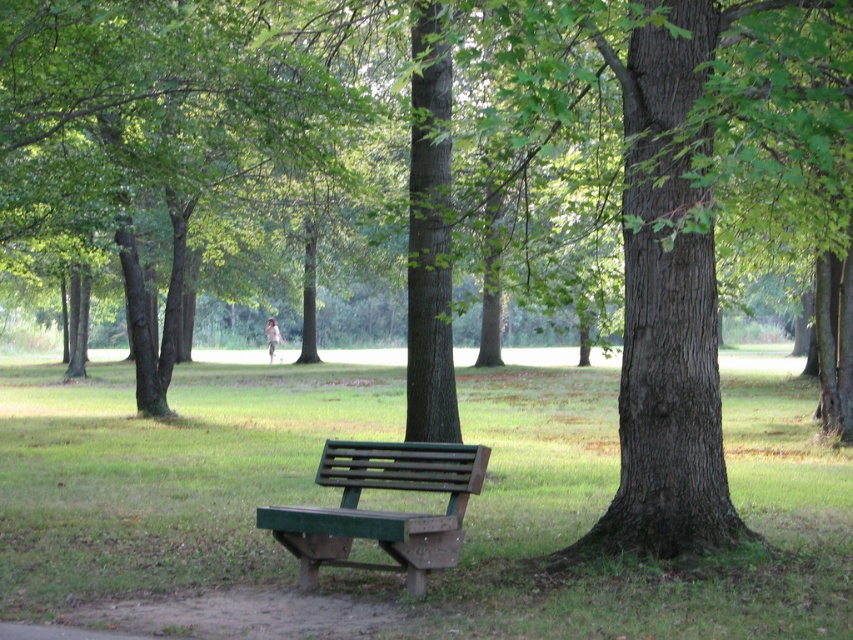
Consider the image. Is green leafy tree at center wider than green wood bench at lower center?

Yes, green leafy tree at center is wider than green wood bench at lower center.

Which is in front, point (264, 138) or point (415, 548)?

Positioned in front is point (415, 548).

Where is `green leafy tree at center`? green leafy tree at center is located at coordinates (146, 129).

Identify the location of green leafy tree at center. The width and height of the screenshot is (853, 640). (146, 129).

Is point (1, 456) positioned before point (173, 77)?

No, it is not.

The image size is (853, 640). Find the location of `green grass at center`. green grass at center is located at coordinates (608, 499).

The width and height of the screenshot is (853, 640). Find the location of `green grass at center`. green grass at center is located at coordinates (608, 499).

Where is `green grass at center`? The image size is (853, 640). green grass at center is located at coordinates (608, 499).

Can you confirm if green grass at center is smaller than green wood bench at lower center?

Actually, green grass at center might be larger than green wood bench at lower center.

Is point (82, 436) less distant than point (397, 561)?

No, (82, 436) is further to viewer.

Who is more forward, (0, 557) or (480, 448)?

Point (480, 448)

At what (x,y) coordinates should I click in order to perform the action: click on green grass at center. Please return your answer as a coordinate pair (x, y). The image size is (853, 640). Looking at the image, I should click on (608, 499).